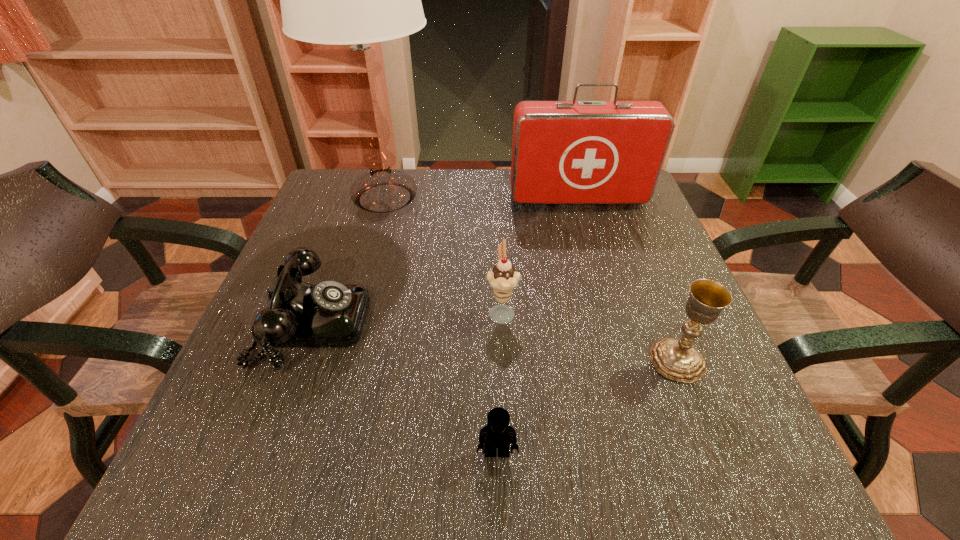
What are the coordinates of `free location located 0.240m on the right of the icecream` in the screenshot? It's located at (644, 311).

Locate an element on the screen. Image resolution: width=960 pixels, height=540 pixels. free space located 0.360m on the dial of the telephone is located at coordinates (559, 322).

Image resolution: width=960 pixels, height=540 pixels. Find the location of `table lamp that is positioned at the far edge`. table lamp that is positioned at the far edge is located at coordinates (339, 0).

The image size is (960, 540). Identify the location of the first-aid kit at the far edge. (563, 152).

At what (x,y) coordinates should I click in order to perform the action: click on object that is at the near edge. Please return your answer as a coordinate pair (x, y). The image size is (960, 540). Looking at the image, I should click on (498, 434).

Image resolution: width=960 pixels, height=540 pixels. I want to click on table lamp present at the left edge, so click(339, 0).

Image resolution: width=960 pixels, height=540 pixels. What are the coordinates of `telephone that is at the left edge` in the screenshot? It's located at (328, 314).

This screenshot has height=540, width=960. I want to click on the first-aid kit at the right edge, so click(x=563, y=152).

You are a GUI agent. You are given a task and a screenshot of the screen. Output one action in this format:
    pyautogui.click(x=<x>, y=<y>)
    Task: Click on the chalice that is at the right edge
    The width and height of the screenshot is (960, 540).
    Given the screenshot: What is the action you would take?
    pyautogui.click(x=677, y=359)

Locate an element on the screen. Image resolution: width=960 pixels, height=540 pixels. object at the far left corner is located at coordinates (339, 0).